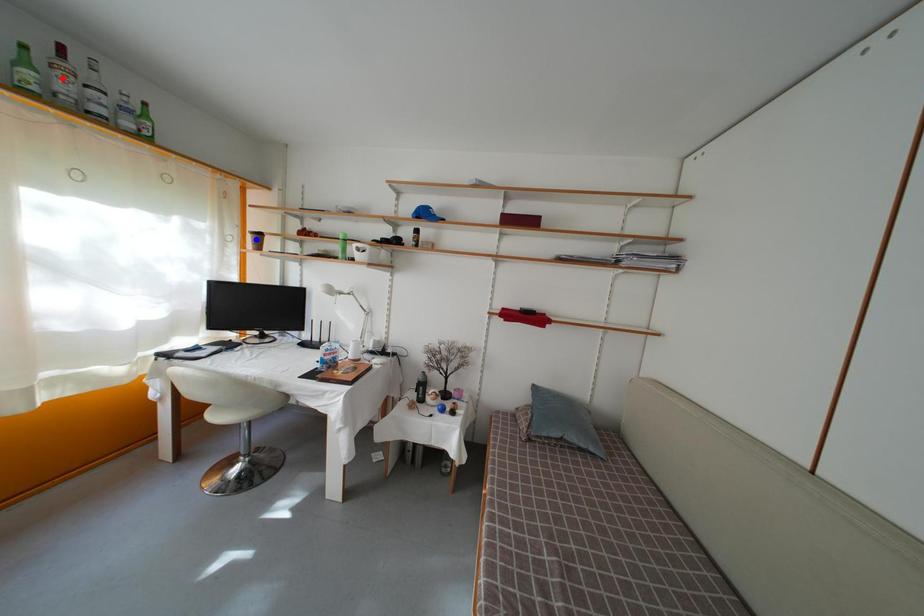
Question: In the image, two points are highlighted. Which point is nearer to the camera? Reply with the corresponding letter.

Choices:
 (A) blue point
 (B) red point

Answer: (B)